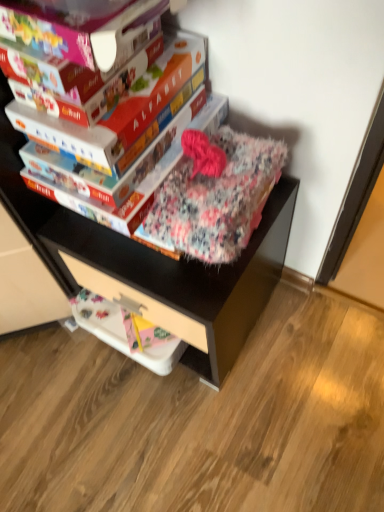
You are a GUI agent. You are given a task and a screenshot of the screen. Output one action in this format:
    pyautogui.click(x=<x>, y=<y>)
    Task: Click on the empty space that is ontop of fluffy floral blanket at center
    The width and height of the screenshot is (384, 512).
    Given the screenshot: What is the action you would take?
    pyautogui.click(x=220, y=167)